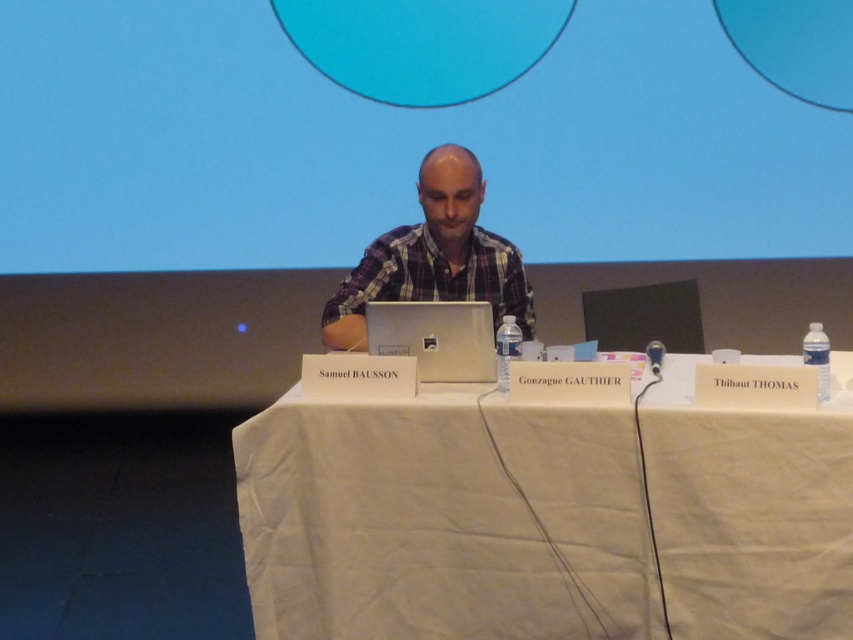
Question: Which point is closer to the camera taking this photo?

Choices:
 (A) (492, 547)
 (B) (653, 220)
 (C) (453, 268)
 (D) (438, 380)

Answer: (A)

Question: Can you confirm if blue matte projection screen at upper center is positioned to the left of silver metallic laptop at center?

Choices:
 (A) no
 (B) yes

Answer: (B)

Question: Among these objects, which one is nearest to the camera?

Choices:
 (A) silver metallic laptop at center
 (B) plaid fabric shirt at center

Answer: (A)

Question: Which of the following is the closest to the observer?

Choices:
 (A) (618, 508)
 (B) (85, 76)

Answer: (A)

Question: Does blue matte projection screen at upper center have a greater width compared to silver metallic laptop at center?

Choices:
 (A) yes
 (B) no

Answer: (A)

Question: Is white cloth table at center thinner than silver metallic laptop at center?

Choices:
 (A) yes
 (B) no

Answer: (B)